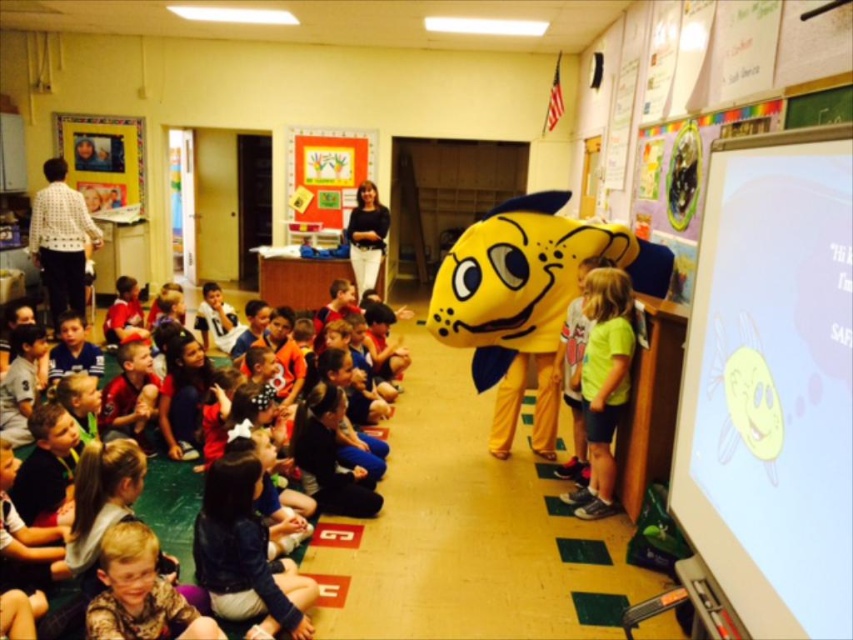
Question: Which point is closer to the camera?

Choices:
 (A) (224, 636)
 (B) (376, 278)
 (C) (624, 276)

Answer: (A)

Question: Does matte black shirt at upper center appear on the right side of matte black shirt at lower left?

Choices:
 (A) no
 (B) yes

Answer: (B)

Question: Does yellow plush fish at right lie behind green matte shirt at center?

Choices:
 (A) no
 (B) yes

Answer: (B)

Question: Which object appears farthest from the camera in this image?

Choices:
 (A) white dotted shirt at upper left
 (B) light brown hair at lower left
 (C) yellow plush fish at right

Answer: (A)

Question: Is yellow plush fish at right bigger than white dotted shirt at upper left?

Choices:
 (A) no
 (B) yes

Answer: (B)

Question: Among these points, which one is nearest to the camera?

Choices:
 (A) (102, 600)
 (B) (49, 268)
 (C) (355, 262)
 (D) (386, 435)

Answer: (A)